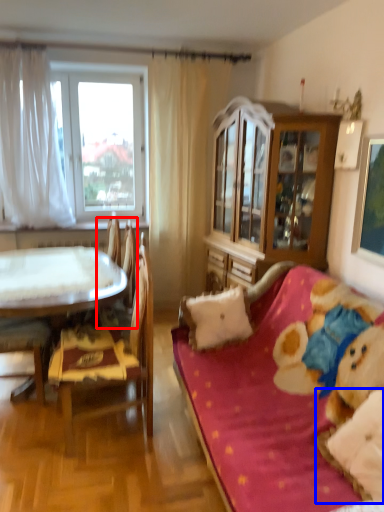
Question: Which of the following is the closest to the observer, armchair (highlighted by a red box) or pillow (highlighted by a blue box)?

Choices:
 (A) armchair
 (B) pillow

Answer: (B)